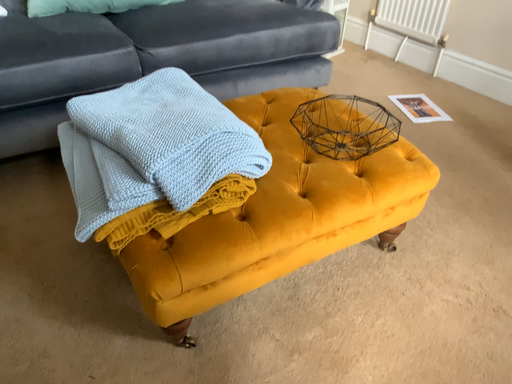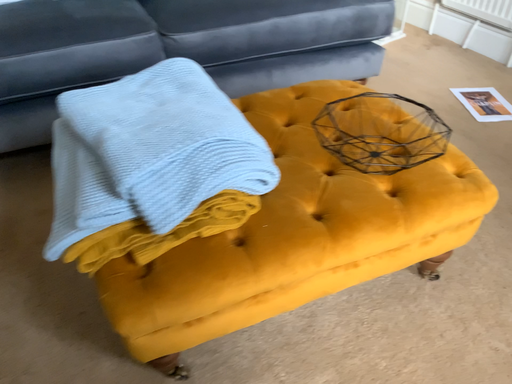
Question: How did the camera likely rotate when shooting the video?

Choices:
 (A) rotated right
 (B) rotated left

Answer: (B)